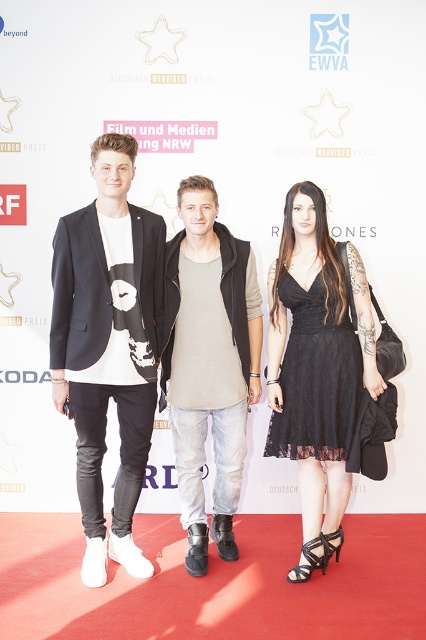
You are a photographer at the event and need to position two items in the foreground for a photo. The matte black blazer at center and the black lace dress at center are both in the frame. Which item should you move closer to the camera to ensure it appears larger in the photo?

The matte black blazer at center is bigger than the black lace dress at center, so to make it appear even larger in the photo, you should move the matte black blazer at center closer to the camera.

You are a photographer at the event and need to ensure that both the black lace dress at center and the denim jeans at center are visible in the frame. Given their sizes, which one should you focus on to ensure both are captured adequately?

The black lace dress at center is smaller than the denim jeans at center. To ensure both are visible, focus on the larger denim jeans at center, as it requires more space in the frame, and the smaller black lace dress at center will naturally fit within the same shot.

You are at an awards ceremony and want to take a photo of the black lace dress at center and denim jeans at center. Which one is positioned to the right side from your perspective?

The black lace dress at center is positioned to the right of the denim jeans at center.